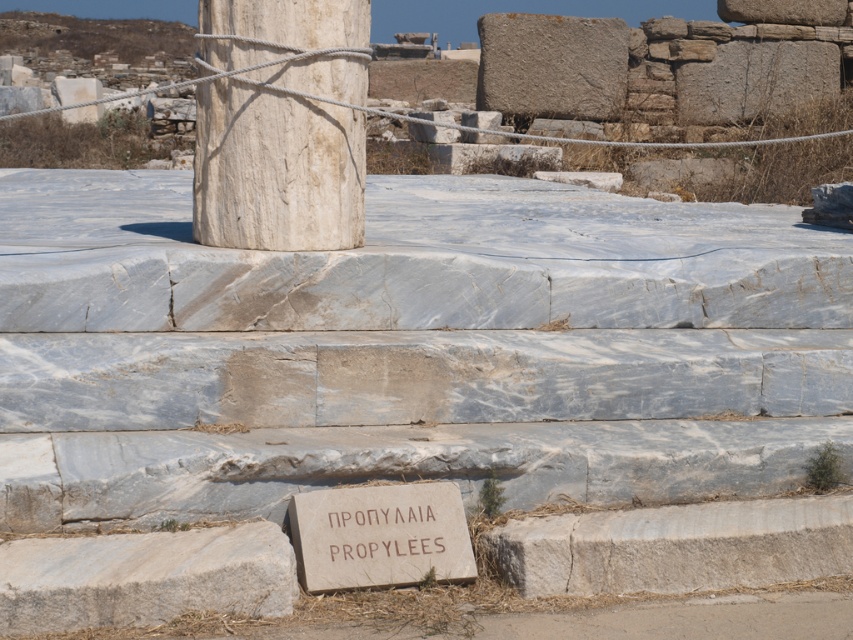
You are a tour guide explaining the ruins to visitors. You want to point out both the white marble column at center and the brown stone sign at center. Which object is positioned to the left when viewed from the front?

The white marble column at center is to the left of the brown stone sign at center.

Looking at this image, you are an archaeologist standing at the base of the marble steps leading to the white marble column at center and the brown stone sign at center. Which object is closer to you?

The white marble column at center is closer to you than the brown stone sign at center.